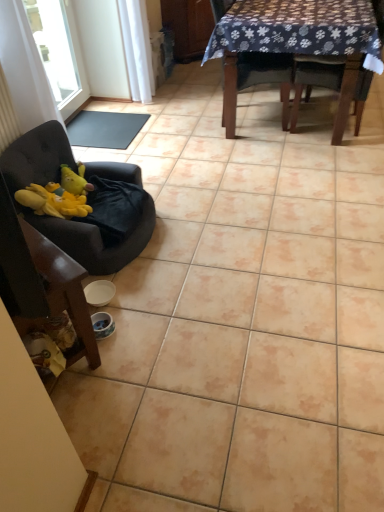
Question: Considering the relative sizes of transparent glass window at upper left and wooden chair at upper right, which is counted as the 3th chair, starting from the left, in the image provided, is transparent glass window at upper left wider than wooden chair at upper right, which is counted as the 3th chair, starting from the left,?

Choices:
 (A) no
 (B) yes

Answer: (A)

Question: Considering the relative sizes of transparent glass window at upper left and wooden chair at upper right, the second chair from the right, in the image provided, is transparent glass window at upper left smaller than wooden chair at upper right, the second chair from the right,?

Choices:
 (A) yes
 (B) no

Answer: (A)

Question: Are transparent glass window at upper left and wooden chair at upper right, the second chair from the right, making contact?

Choices:
 (A) no
 (B) yes

Answer: (A)

Question: Is transparent glass window at upper left aimed at wooden chair at upper right, which is counted as the 3th chair, starting from the left?

Choices:
 (A) yes
 (B) no

Answer: (A)

Question: Is there a large distance between transparent glass window at upper left and wooden chair at upper right, the second chair from the right?

Choices:
 (A) yes
 (B) no

Answer: (A)

Question: Would you say transparent glass window at upper left is inside or outside yellow plush at left?

Choices:
 (A) inside
 (B) outside

Answer: (B)

Question: Is transparent glass window at upper left wider or thinner than yellow plush at left?

Choices:
 (A) thin
 (B) wide

Answer: (A)

Question: Is point (66, 88) closer or farther from the camera than point (59, 184)?

Choices:
 (A) farther
 (B) closer

Answer: (A)

Question: Is transparent glass window at upper left bigger or smaller than yellow plush at left?

Choices:
 (A) big
 (B) small

Answer: (A)

Question: From the image's perspective, is dark fabric chair at upper right, arranged as the fourth chair when viewed from the left, above or below wooden table at upper center?

Choices:
 (A) below
 (B) above

Answer: (A)

Question: Looking at their shapes, would you say dark fabric chair at upper right, arranged as the fourth chair when viewed from the left, is wider or thinner than wooden table at upper center?

Choices:
 (A) wide
 (B) thin

Answer: (B)

Question: Is dark fabric chair at upper right, the 1th chair in the right-to-left sequence, in front of or behind wooden table at upper center in the image?

Choices:
 (A) front
 (B) behind

Answer: (B)

Question: Looking at the image, does dark fabric chair at upper right, arranged as the fourth chair when viewed from the left, seem bigger or smaller compared to wooden table at upper center?

Choices:
 (A) small
 (B) big

Answer: (A)

Question: In terms of size, does yellow plush at left appear bigger or smaller than dark fabric chair at upper right, arranged as the fourth chair when viewed from the left?

Choices:
 (A) big
 (B) small

Answer: (B)

Question: Is yellow plush at left wider or thinner than dark fabric chair at upper right, the 1th chair in the right-to-left sequence?

Choices:
 (A) wide
 (B) thin

Answer: (B)